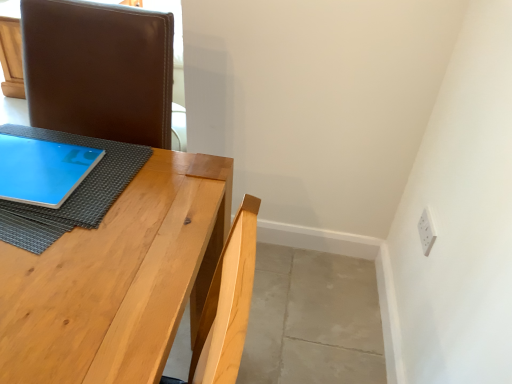
This screenshot has width=512, height=384. Find the location of `free point above matte blue tablet at left (from a real-world perspective)`. free point above matte blue tablet at left (from a real-world perspective) is located at coordinates (35, 169).